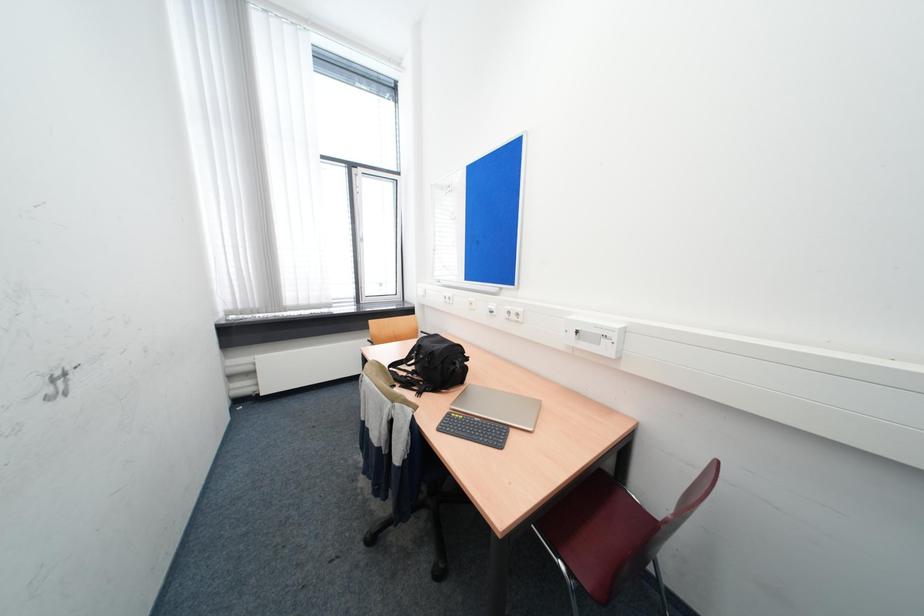
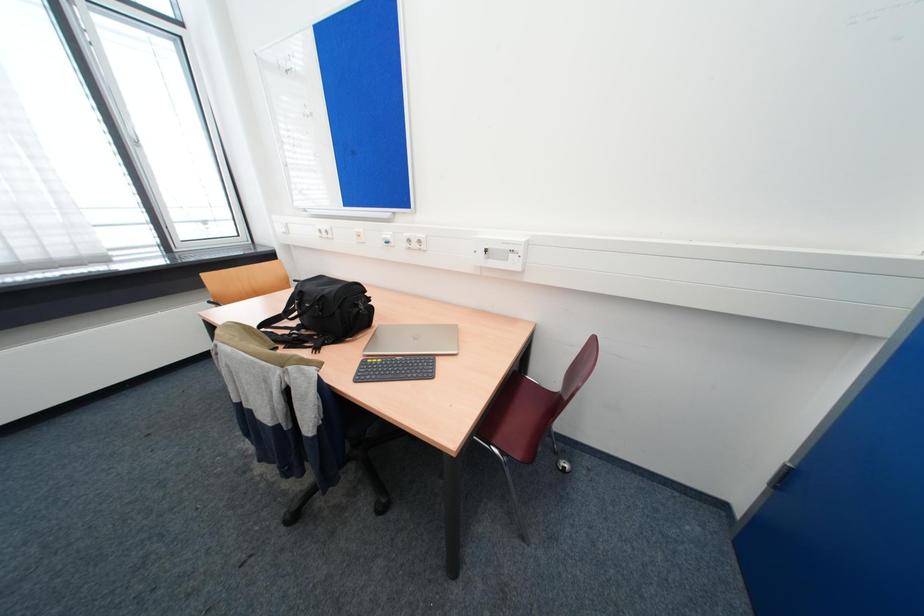
In a continuous first-person perspective shot, in which direction is the camera moving?

The cameraman moved toward left, forward.